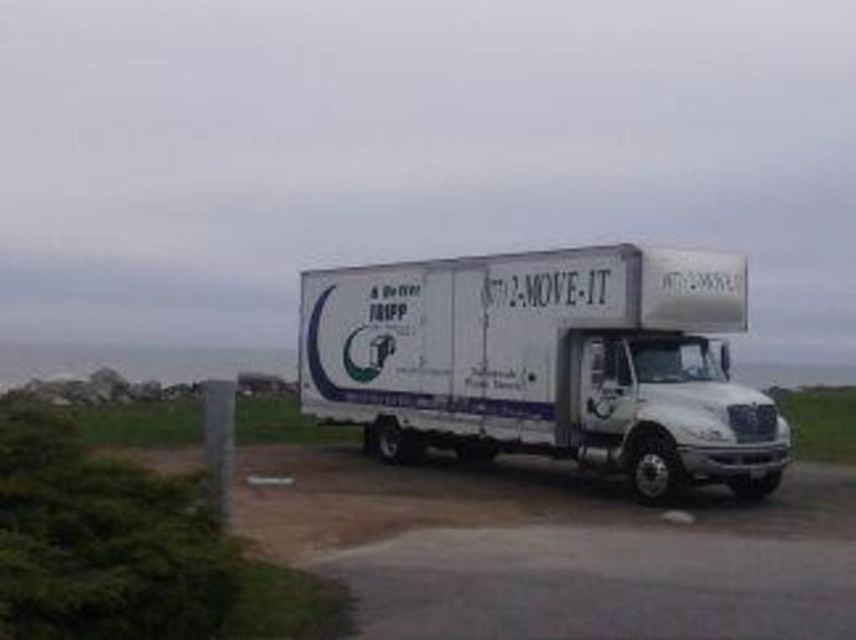
Question: Is white matte trailer truck at center thinner than green grass at lower left?

Choices:
 (A) yes
 (B) no

Answer: (B)

Question: Can you confirm if white matte trailer truck at center is positioned to the left of green grass at lower left?

Choices:
 (A) yes
 (B) no

Answer: (B)

Question: Which of the following is the farthest from the observer?

Choices:
 (A) (322, 349)
 (B) (245, 616)

Answer: (A)

Question: Which object appears farthest from the camera in this image?

Choices:
 (A) green grass at lower left
 (B) white matte trailer truck at center

Answer: (B)

Question: Does white matte trailer truck at center appear on the left side of green grass at lower left?

Choices:
 (A) yes
 (B) no

Answer: (B)

Question: Which point is farther to the camera?

Choices:
 (A) (230, 554)
 (B) (336, 422)

Answer: (B)